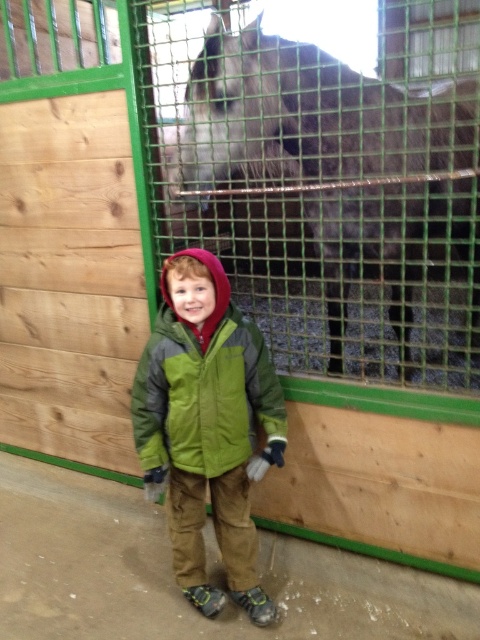
Can you confirm if dark brown fur at upper center is smaller than green fleece jacket at center?

No.

How distant is dark brown fur at upper center from green fleece jacket at center?

32.47 inches

Where is `dark brown fur at upper center`? The image size is (480, 640). dark brown fur at upper center is located at coordinates (313, 116).